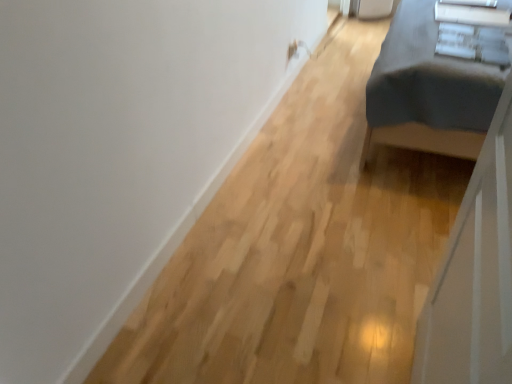
Find the location of a particular element. The image size is (512, 384). white glossy changing table at upper right is located at coordinates (472, 33).

The height and width of the screenshot is (384, 512). Describe the element at coordinates (472, 33) in the screenshot. I see `white glossy changing table at upper right` at that location.

Find the location of a particular element. This screenshot has width=512, height=384. white glossy changing table at upper right is located at coordinates [472, 33].